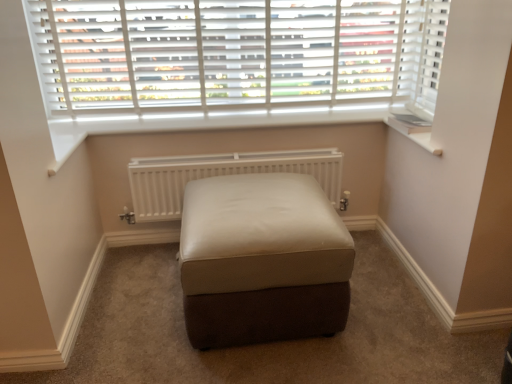
Find the location of a particular element. This screenshot has width=512, height=384. free spot above white matte radiator at center (from a real-world perspective) is located at coordinates (257, 150).